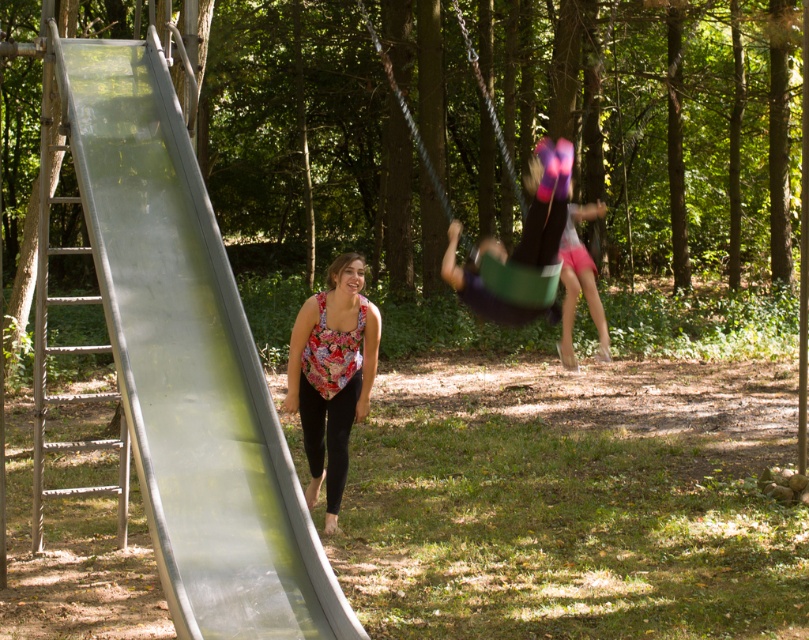
You are a photographer trying to capture both the metallic smooth slide at left and the floral fabric top at center in a single frame. Given their sizes, which object will occupy more space in your photo?

The metallic smooth slide at left is bigger than the floral fabric top at center, so it will occupy more space in the photo.

You are a parent trying to decide between placing your child on the metallic smooth slide at left or the green plastic swing at center. Considering the width of the two, which one might be more comfortable for a child who prefers wider seats?

The green plastic swing at center has a greater width than the metallic smooth slide at left, so it would be more comfortable for a child who prefers wider seats.

You are a parent standing at the entrance of the playground, which is 3 meters away from the metallic smooth slide at left. You want to hand your child a water bottle located on the floral fabric top at center. Can you reach the water bottle without moving from your current position?

The metallic smooth slide at left is 2.10 meters away from the floral fabric top at center. Since you are 3 meters away from the slide, the total distance between you and the floral fabric top at center is 3 meters minus 2.10 meters, which equals 0.90 meters. Therefore, you can easily reach the water bottle on the floral fabric top at center without moving.